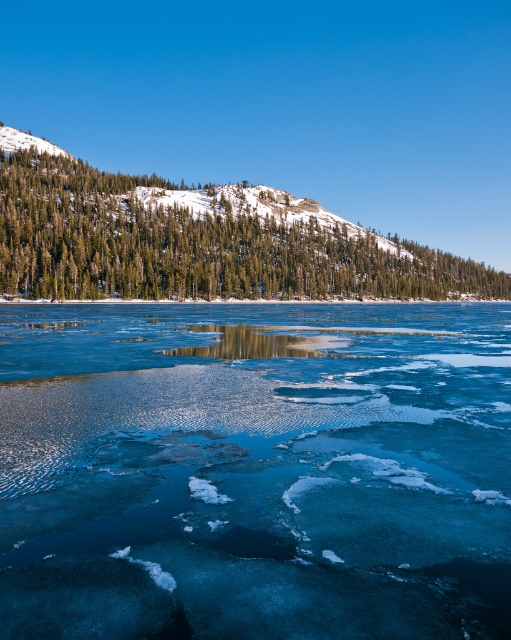
Which of these two, translucent ice at center or green textured pine trees at upper left, stands shorter?

With less height is translucent ice at center.

Who is higher up, translucent ice at center or green textured pine trees at upper left?

green textured pine trees at upper left is higher up.

Which is in front, point (100, 548) or point (14, 268)?

Positioned in front is point (100, 548).

You are a GUI agent. You are given a task and a screenshot of the screen. Output one action in this format:
    pyautogui.click(x=<x>, y=<y>)
    Task: Click on the translucent ice at center
    
    Given the screenshot: What is the action you would take?
    pyautogui.click(x=254, y=470)